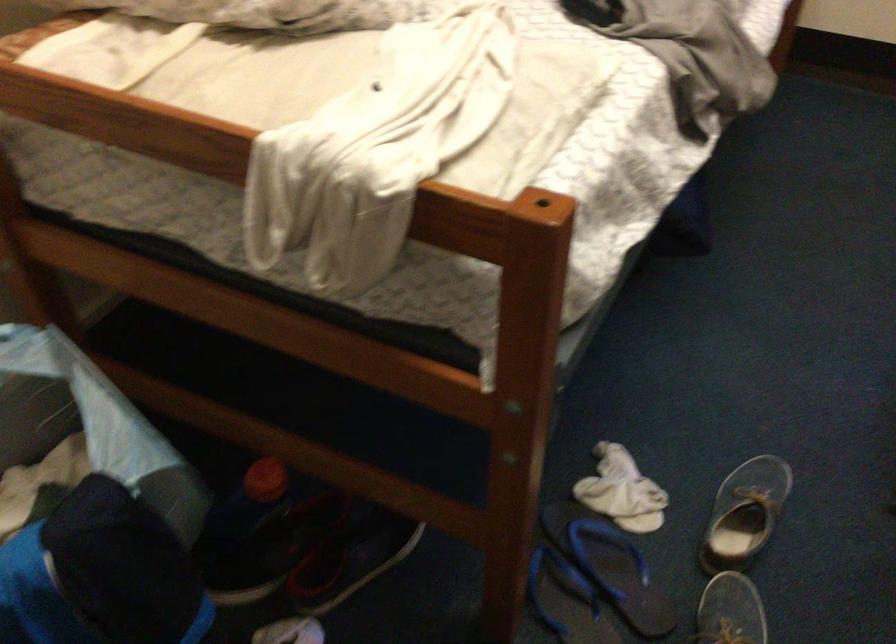
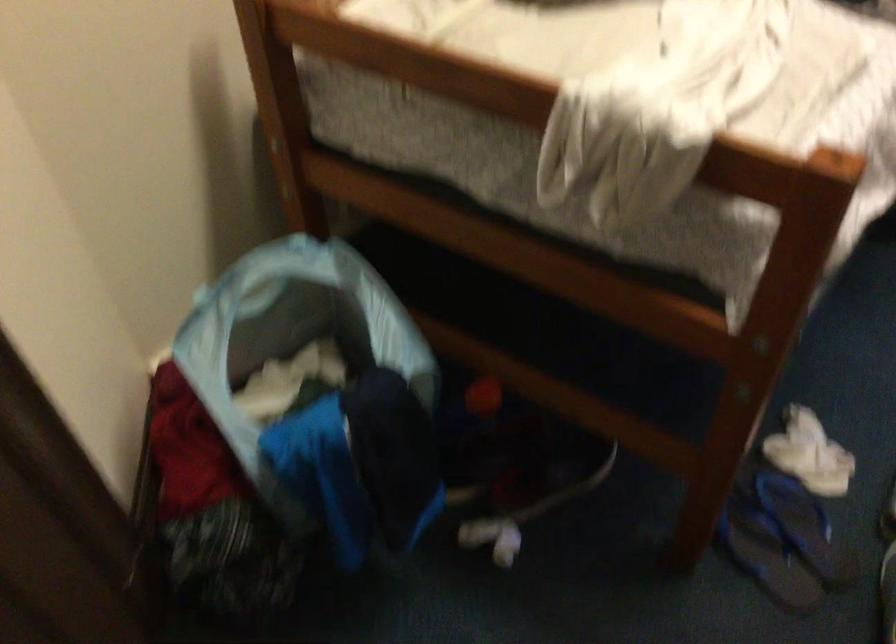
The images are taken continuously from a first-person perspective. In which direction are you moving?

The cameraman walked toward left, backward.